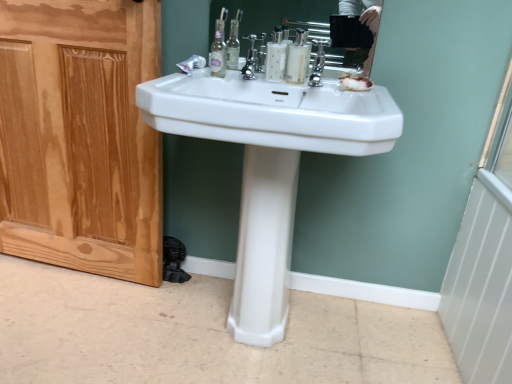
I want to click on vacant space underneath white glossy sink at center (from a real-world perspective), so click(265, 346).